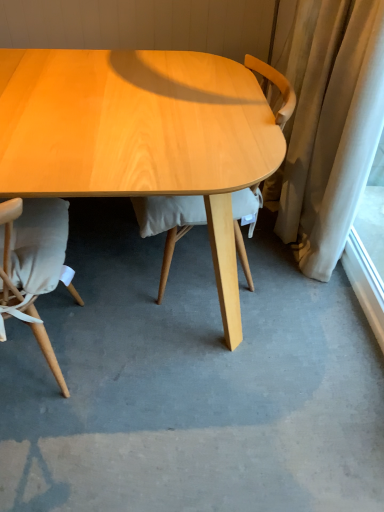
The width and height of the screenshot is (384, 512). Find the location of `vacant area located to the right-hand side of light wood chair at center, which is counted as the second chair, starting from the left`. vacant area located to the right-hand side of light wood chair at center, which is counted as the second chair, starting from the left is located at coordinates (296, 297).